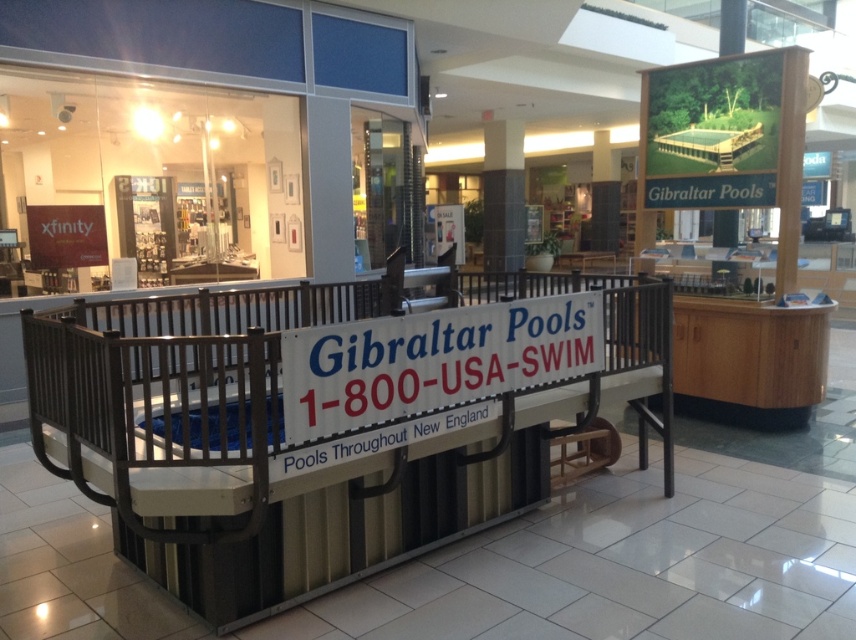
Who is positioned more to the left, metallic gray balustrade at center or white plastic sign at center?

metallic gray balustrade at center

Who is shorter, metallic gray balustrade at center or white plastic sign at center?

With less height is white plastic sign at center.

Which is behind, point (583, 292) or point (485, 353)?

The point (583, 292) is behind.

Locate an element on the screen. This screenshot has height=640, width=856. metallic gray balustrade at center is located at coordinates (317, 428).